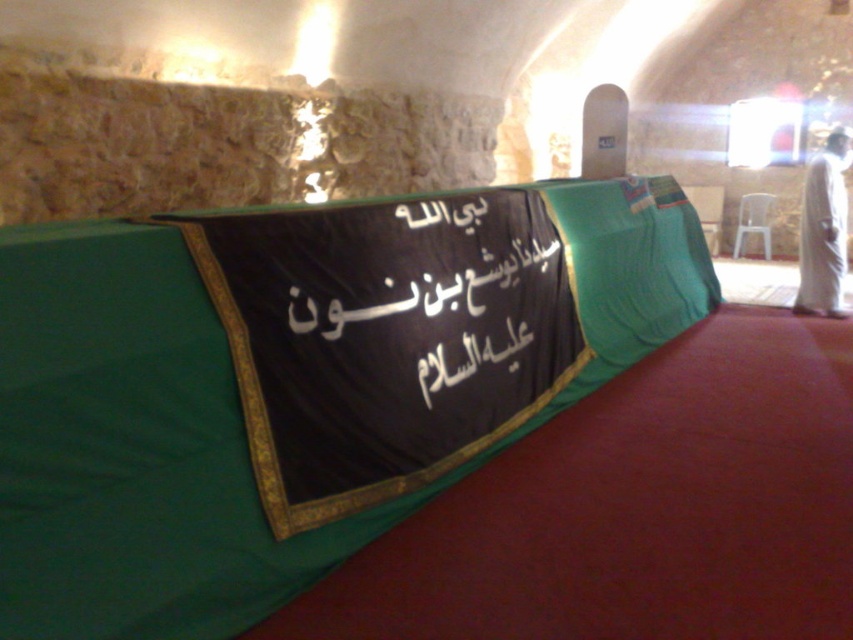
Question: Can you confirm if green fabric at center is wider than black fabric text at center?

Choices:
 (A) yes
 (B) no

Answer: (A)

Question: Considering the real-world distances, which object is farthest from the white clothed figure at right?

Choices:
 (A) green fabric at center
 (B) black fabric text at center

Answer: (B)

Question: Which point is farther from the camera taking this photo?

Choices:
 (A) (492, 349)
 (B) (825, 184)

Answer: (B)

Question: Does green fabric at center have a smaller size compared to black fabric text at center?

Choices:
 (A) no
 (B) yes

Answer: (A)

Question: Can you confirm if green fabric at center is wider than black fabric text at center?

Choices:
 (A) no
 (B) yes

Answer: (B)

Question: Which of the following is the closest to the observer?

Choices:
 (A) (817, 204)
 (B) (643, 196)

Answer: (B)